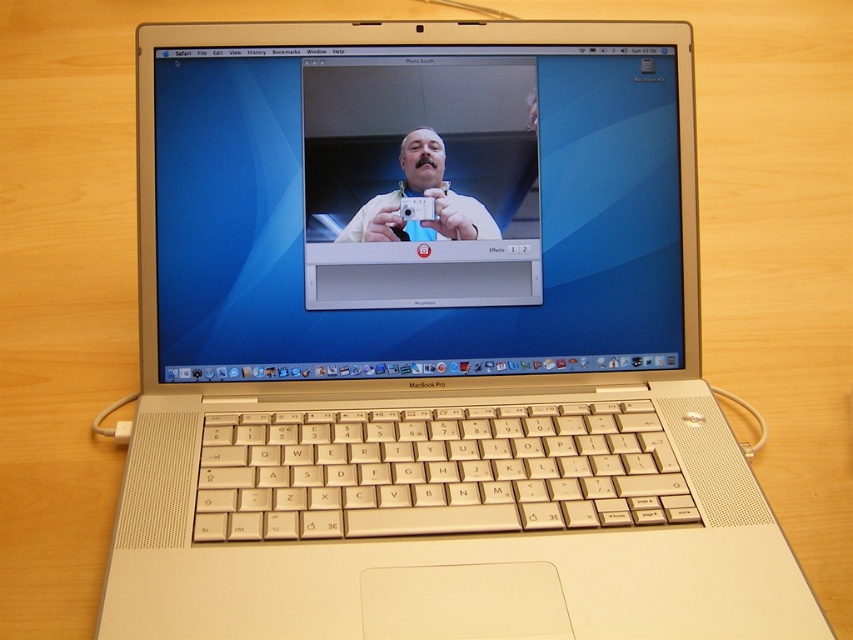
Question: Which object appears farthest from the camera in this image?

Choices:
 (A) white plastic camera at center
 (B) satin gold laptop at center

Answer: (A)

Question: Where is satin gold laptop at center located in relation to white plastic camera at center in the image?

Choices:
 (A) left
 (B) right

Answer: (B)

Question: Which point is farther to the camera?

Choices:
 (A) white plastic camera at center
 (B) satin gold laptop at center

Answer: (A)

Question: Which object is farther from the camera taking this photo?

Choices:
 (A) satin gold laptop at center
 (B) white plastic camera at center

Answer: (B)

Question: Is satin gold laptop at center in front of white plastic camera at center?

Choices:
 (A) yes
 (B) no

Answer: (A)

Question: Where is satin gold laptop at center located in relation to white plastic camera at center in the image?

Choices:
 (A) left
 (B) right

Answer: (B)